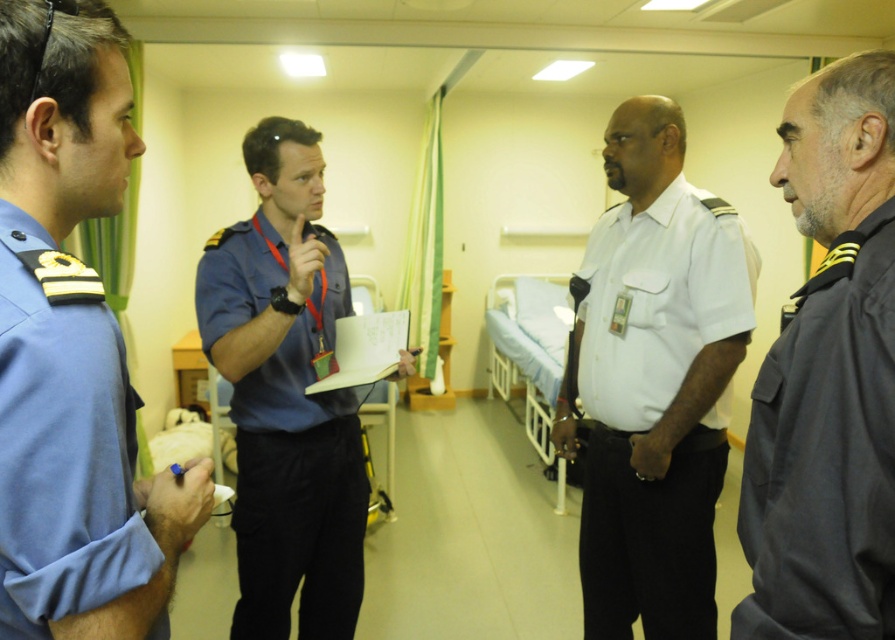
You are a patient in the hospital ward and need to locate the medical staff. Which direction should you look to find the blue uniform at left?

The blue uniform at left is located at point 0.750 on the x and 0.087 on the y coordinate, so you should look to your left side since it is positioned on the left side of the scene.

You are a patient in the hospital ward and need to locate the nurse station. You see a dark gray cotton shirt at right and a blue uniform at center. Which staff member is closer to the right side of the room?

The dark gray cotton shirt at right is closer to the right side of the room because it is positioned to the right of the blue uniform at center.

You are a patient in the hospital ward and need to locate two specific points marked on the floor. The first point is at coordinate point(x=97, y=109) and the second is at point(x=816, y=381). From your current position, which point is closer to you?

Point(x=97, y=109) is in front of point(x=816, y=381), so the first point is closer to you.